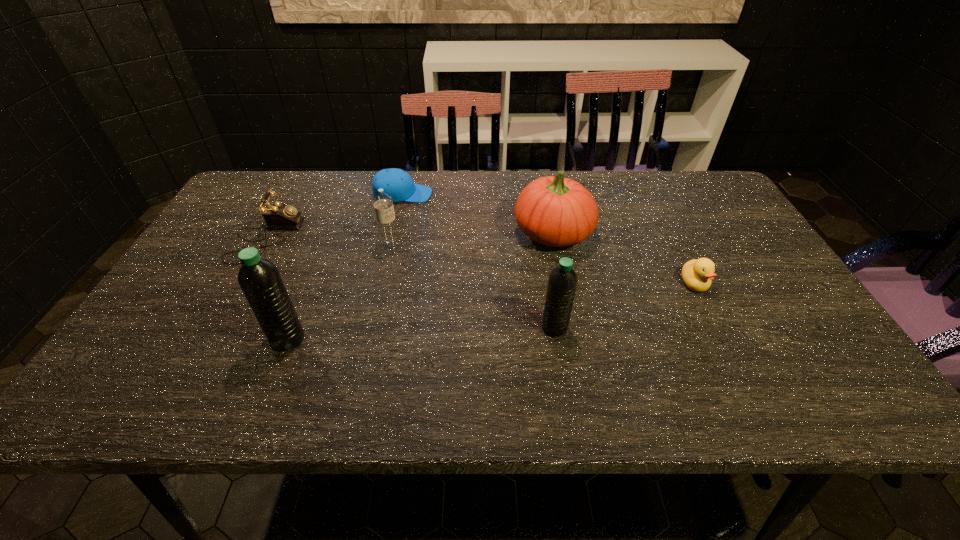
The image size is (960, 540). In order to click on free space between the leftmost water bottle and the pumpkin in this screenshot , I will do `click(420, 286)`.

Find the location of a particular element. free space between the leftmost water bottle and the rightmost water bottle is located at coordinates (421, 333).

Locate an element on the screen. The height and width of the screenshot is (540, 960). vacant space that is in between the tallest object and the pumpkin is located at coordinates (420, 286).

You are a GUI agent. You are given a task and a screenshot of the screen. Output one action in this format:
    pyautogui.click(x=<x>, y=<y>)
    Task: Click on the vacant point located between the second water bottle from right to left and the telephone
    This screenshot has height=540, width=960.
    Given the screenshot: What is the action you would take?
    pyautogui.click(x=328, y=242)

Locate an element on the screen. The width and height of the screenshot is (960, 540). free space between the farthest water bottle and the rightmost water bottle is located at coordinates (472, 287).

Image resolution: width=960 pixels, height=540 pixels. What are the coordinates of `object that is the closest to the pumpkin` in the screenshot? It's located at (697, 274).

You are a GUI agent. You are given a task and a screenshot of the screen. Output one action in this format:
    pyautogui.click(x=<x>, y=<y>)
    Task: Click on the third closest object to the farthest water bottle
    The width and height of the screenshot is (960, 540).
    Given the screenshot: What is the action you would take?
    pyautogui.click(x=260, y=280)

Where is `water bottle object that ranks as the third closest to the fifth farthest object`? This screenshot has height=540, width=960. water bottle object that ranks as the third closest to the fifth farthest object is located at coordinates (260, 280).

Locate an element on the screen. The width and height of the screenshot is (960, 540). water bottle that is the closest to the duckling is located at coordinates (562, 282).

The height and width of the screenshot is (540, 960). Find the location of `free point that satisfies the following two spatial constraints: 1. on the dial of the telephone; 2. on the back side of the tallest object`. free point that satisfies the following two spatial constraints: 1. on the dial of the telephone; 2. on the back side of the tallest object is located at coordinates pyautogui.click(x=209, y=339).